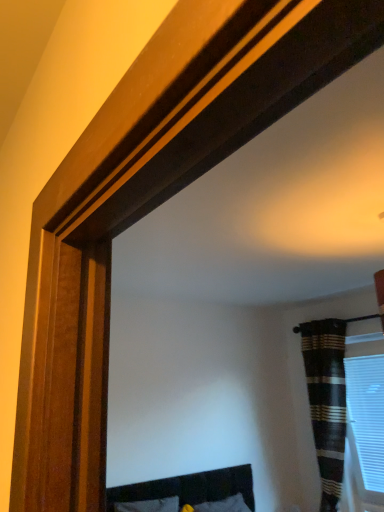
Question: From a real-world perspective, does white plastic blinds at right stand above striped fabric curtain at right?

Choices:
 (A) no
 (B) yes

Answer: (A)

Question: From a real-world perspective, is white plastic blinds at right physically below striped fabric curtain at right?

Choices:
 (A) yes
 (B) no

Answer: (A)

Question: Are white plastic blinds at right and striped fabric curtain at right located far from each other?

Choices:
 (A) yes
 (B) no

Answer: (B)

Question: Is white plastic blinds at right closer to camera compared to striped fabric curtain at right?

Choices:
 (A) yes
 (B) no

Answer: (B)

Question: Is white plastic blinds at right located outside striped fabric curtain at right?

Choices:
 (A) no
 (B) yes

Answer: (B)

Question: Considering the relative sizes of white plastic blinds at right and striped fabric curtain at right in the image provided, is white plastic blinds at right shorter than striped fabric curtain at right?

Choices:
 (A) no
 (B) yes

Answer: (B)

Question: Does striped fabric curtain at right have a lesser height compared to white plastic blinds at right?

Choices:
 (A) yes
 (B) no

Answer: (B)

Question: Considering the relative positions of striped fabric curtain at right and white plastic blinds at right in the image provided, is striped fabric curtain at right to the left of white plastic blinds at right from the viewer's perspective?

Choices:
 (A) no
 (B) yes

Answer: (B)

Question: Does striped fabric curtain at right have a greater height compared to white plastic blinds at right?

Choices:
 (A) yes
 (B) no

Answer: (A)

Question: Considering the relative sizes of striped fabric curtain at right and white plastic blinds at right in the image provided, is striped fabric curtain at right smaller than white plastic blinds at right?

Choices:
 (A) no
 (B) yes

Answer: (A)

Question: Considering the relative positions of striped fabric curtain at right and white plastic blinds at right in the image provided, is striped fabric curtain at right in front of white plastic blinds at right?

Choices:
 (A) yes
 (B) no

Answer: (A)

Question: Is striped fabric curtain at right wider than white plastic blinds at right?

Choices:
 (A) yes
 (B) no

Answer: (A)

Question: Considering the relative positions of striped fabric curtain at right and white plastic blinds at right in the image provided, is striped fabric curtain at right to the left or to the right of white plastic blinds at right?

Choices:
 (A) right
 (B) left

Answer: (B)